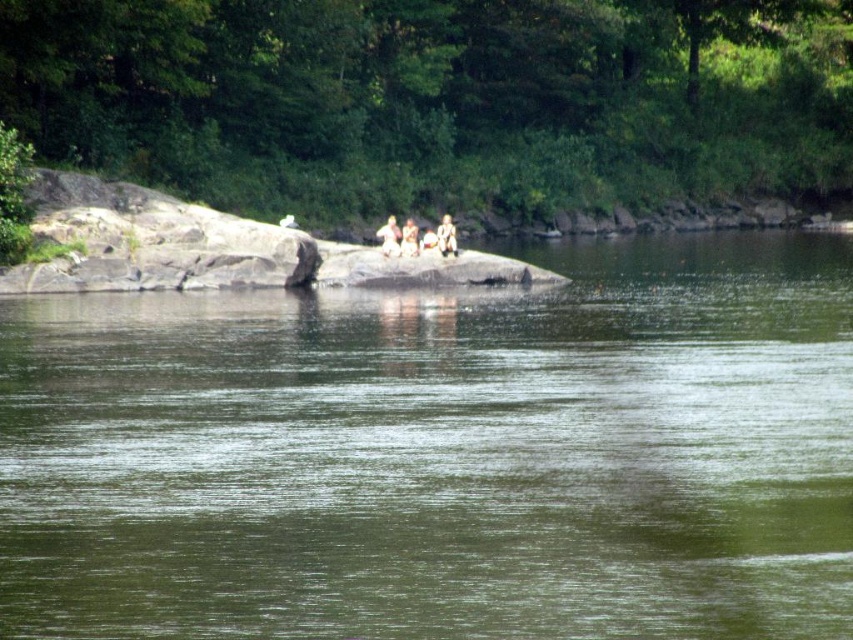
Question: Does green smooth water at center appear over blurred human figure at center?

Choices:
 (A) no
 (B) yes

Answer: (A)

Question: Which point is closer to the camera taking this photo?

Choices:
 (A) (416, 241)
 (B) (91, 426)

Answer: (B)

Question: Which of the following is the closest to the observer?

Choices:
 (A) (395, 221)
 (B) (409, 225)

Answer: (B)

Question: Does green smooth water at center appear over blurred human figure at center?

Choices:
 (A) yes
 (B) no

Answer: (B)

Question: Is camouflage fabric person at center positioned behind blurred human figure at center?

Choices:
 (A) yes
 (B) no

Answer: (A)

Question: Which of the following is the closest to the observer?

Choices:
 (A) (444, 236)
 (B) (80, 627)
 (C) (415, 248)

Answer: (B)